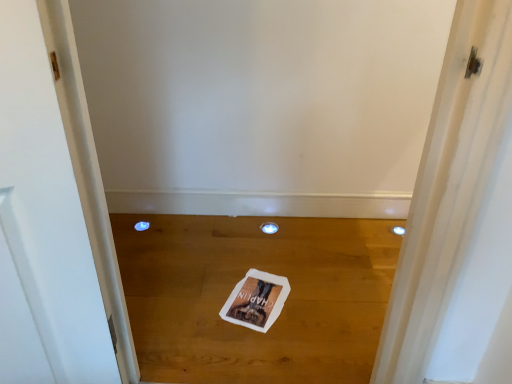
What is the approximate height of blue plastic hole at lower left, the first hole viewed from the left?

1.21 inches.

Where is `white paper at center`? white paper at center is located at coordinates (241, 278).

This screenshot has height=384, width=512. Describe the element at coordinates (256, 300) in the screenshot. I see `white paper magazine at center` at that location.

Find the location of `transparent plastic hole at center, acting as the first hole starting from the right`. transparent plastic hole at center, acting as the first hole starting from the right is located at coordinates (269, 227).

Does white paper at center appear on the right side of transparent plastic hole at center, which is the 2th hole from left to right?

Incorrect, white paper at center is not on the right side of transparent plastic hole at center, which is the 2th hole from left to right.

From the image's perspective, is white paper at center located beneath transparent plastic hole at center, acting as the first hole starting from the right?

Correct, white paper at center appears lower than transparent plastic hole at center, acting as the first hole starting from the right, in the image.

Considering the sizes of objects white paper at center and transparent plastic hole at center, which is the 2th hole from left to right, in the image provided, who is bigger, white paper at center or transparent plastic hole at center, which is the 2th hole from left to right,?

white paper at center.

Is white paper at center inside the boundaries of transparent plastic hole at center, acting as the first hole starting from the right, or outside?

white paper at center is not enclosed by transparent plastic hole at center, acting as the first hole starting from the right.

What's the angular difference between transparent plastic hole at center, acting as the first hole starting from the right, and white paper magazine at center's facing directions?

The angle between the facing direction of transparent plastic hole at center, acting as the first hole starting from the right, and the facing direction of white paper magazine at center is 155 degrees.

Between transparent plastic hole at center, acting as the first hole starting from the right, and white paper magazine at center, which one has smaller width?

Thinner between the two is transparent plastic hole at center, acting as the first hole starting from the right.

Is transparent plastic hole at center, acting as the first hole starting from the right, positioned with its back to white paper magazine at center?

No, transparent plastic hole at center, acting as the first hole starting from the right, is not facing the opposite direction of white paper magazine at center.

The height and width of the screenshot is (384, 512). In order to click on magazine that appears above the transparent plastic hole at center, which is the 2th hole from left to right (from a real-world perspective) in this screenshot , I will do `click(256, 300)`.

How many degrees apart are the facing directions of blue plastic hole at lower left, the second hole when ordered from right to left, and transparent plastic hole at center, acting as the first hole starting from the right?

0.731 degrees.

Is blue plastic hole at lower left, the first hole viewed from the left, situated inside transparent plastic hole at center, which is the 2th hole from left to right, or outside?

blue plastic hole at lower left, the first hole viewed from the left, is not enclosed by transparent plastic hole at center, which is the 2th hole from left to right.

Is the depth of blue plastic hole at lower left, the first hole viewed from the left, less than that of transparent plastic hole at center, which is the 2th hole from left to right?

No, blue plastic hole at lower left, the first hole viewed from the left, is further to the viewer.

From a real-world perspective, is white paper at center physically located above or below white paper magazine at center?

In terms of real-world spatial position, white paper at center is below white paper magazine at center.

Considering the positions of points (146, 309) and (237, 308), is point (146, 309) closer to camera compared to point (237, 308)?

That is True.

Where is `plain that is in front of the white paper magazine at center`? The width and height of the screenshot is (512, 384). plain that is in front of the white paper magazine at center is located at coordinates (241, 278).

Considering the sizes of objects white paper at center and white paper magazine at center in the image provided, who is taller, white paper at center or white paper magazine at center?

white paper at center.

From a real-world perspective, is blue plastic hole at lower left, the first hole viewed from the left, on white paper at center?

No, from a real-world perspective, blue plastic hole at lower left, the first hole viewed from the left, is not above white paper at center.

Which object is further away from the camera taking this photo, blue plastic hole at lower left, the first hole viewed from the left, or white paper at center?

blue plastic hole at lower left, the first hole viewed from the left, is more distant.

Looking at this image, looking at the image, does blue plastic hole at lower left, the first hole viewed from the left, seem bigger or smaller compared to white paper at center?

In the image, blue plastic hole at lower left, the first hole viewed from the left, appears to be smaller than white paper at center.

Which is behind, point (148, 227) or point (262, 367)?

Positioned behind is point (148, 227).

Identify the location of the 2nd hole behind the white paper at center. [x=142, y=226].

Is white paper at center situated inside blue plastic hole at lower left, the first hole viewed from the left, or outside?

white paper at center exists outside the volume of blue plastic hole at lower left, the first hole viewed from the left.

Is white paper at center turned away from blue plastic hole at lower left, the first hole viewed from the left?

That's not correct — white paper at center is not looking away from blue plastic hole at lower left, the first hole viewed from the left.

From a real-world perspective, is white paper at center over blue plastic hole at lower left, the second hole when ordered from right to left?

Yes, from a real-world perspective, white paper at center is on top of blue plastic hole at lower left, the second hole when ordered from right to left.

Find the location of `the 1st hole behind the white paper magazine at center`. the 1st hole behind the white paper magazine at center is located at coordinates (269, 227).

Considering the relative positions of white paper magazine at center and transparent plastic hole at center, acting as the first hole starting from the right, in the image provided, is white paper magazine at center to the left of transparent plastic hole at center, acting as the first hole starting from the right, from the viewer's perspective?

Yes, white paper magazine at center is to the left of transparent plastic hole at center, acting as the first hole starting from the right.

Relative to transparent plastic hole at center, acting as the first hole starting from the right, is white paper magazine at center in front or behind?

Clearly, white paper magazine at center is in front of transparent plastic hole at center, acting as the first hole starting from the right.

How many degrees apart are the facing directions of white paper magazine at center and transparent plastic hole at center, acting as the first hole starting from the right?

155 degrees.

Where is `plain below the transparent plastic hole at center, acting as the first hole starting from the right (from the image's perspective)`? The height and width of the screenshot is (384, 512). plain below the transparent plastic hole at center, acting as the first hole starting from the right (from the image's perspective) is located at coordinates (241, 278).

This screenshot has height=384, width=512. I want to click on magazine in front of the transparent plastic hole at center, acting as the first hole starting from the right, so click(256, 300).

Considering their positions, is white paper at center positioned further to blue plastic hole at lower left, the second hole when ordered from right to left, than transparent plastic hole at center, acting as the first hole starting from the right?

white paper at center.

Which object lies nearer to the anchor point white paper magazine at center, white paper at center or transparent plastic hole at center, acting as the first hole starting from the right?

white paper at center is positioned closer to the anchor white paper magazine at center.

Based on their spatial positions, is white paper magazine at center or transparent plastic hole at center, which is the 2th hole from left to right, closer to blue plastic hole at lower left, the first hole viewed from the left?

transparent plastic hole at center, which is the 2th hole from left to right, is closer to blue plastic hole at lower left, the first hole viewed from the left.

Which object lies further to the anchor point blue plastic hole at lower left, the first hole viewed from the left, transparent plastic hole at center, acting as the first hole starting from the right, or white paper magazine at center?

white paper magazine at center is further to blue plastic hole at lower left, the first hole viewed from the left.

Based on their spatial positions, is blue plastic hole at lower left, the first hole viewed from the left, or transparent plastic hole at center, which is the 2th hole from left to right, closer to white paper at center?

transparent plastic hole at center, which is the 2th hole from left to right, is positioned closer to the anchor white paper at center.

Based on their spatial positions, is transparent plastic hole at center, which is the 2th hole from left to right, or white paper at center further from white paper magazine at center?

transparent plastic hole at center, which is the 2th hole from left to right, is positioned further to the anchor white paper magazine at center.

Considering their positions, is white paper magazine at center positioned closer to white paper at center than transparent plastic hole at center, acting as the first hole starting from the right?

white paper magazine at center lies closer to white paper at center than the other object.

When comparing their distances from transparent plastic hole at center, which is the 2th hole from left to right, does blue plastic hole at lower left, the first hole viewed from the left, or white paper magazine at center seem closer?

The object closer to transparent plastic hole at center, which is the 2th hole from left to right, is white paper magazine at center.

The width and height of the screenshot is (512, 384). I want to click on magazine between blue plastic hole at lower left, the second hole when ordered from right to left, and transparent plastic hole at center, acting as the first hole starting from the right, from left to right, so click(x=256, y=300).

Where is `hole between white paper at center and blue plastic hole at lower left, the first hole viewed from the left, from front to back`? The width and height of the screenshot is (512, 384). hole between white paper at center and blue plastic hole at lower left, the first hole viewed from the left, from front to back is located at coordinates (269, 227).

Image resolution: width=512 pixels, height=384 pixels. I want to click on magazine between white paper at center and transparent plastic hole at center, acting as the first hole starting from the right, in the front-back direction, so click(256, 300).

Locate an element on the screen. magazine between white paper at center and blue plastic hole at lower left, the first hole viewed from the left, in the front-back direction is located at coordinates (256, 300).